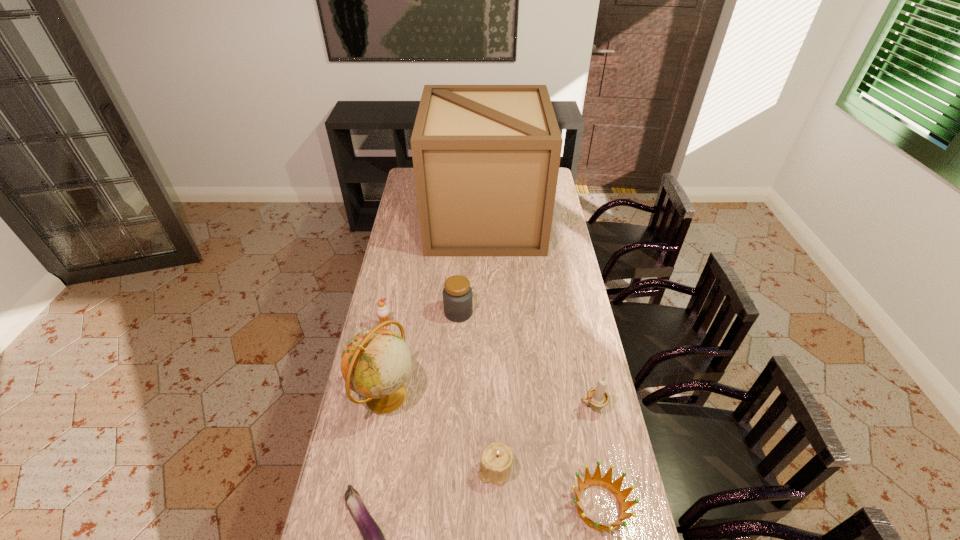
Find the location of a particular element. The height and width of the screenshot is (540, 960). vacant area between the icecream and the farther candle_holder is located at coordinates (489, 366).

The height and width of the screenshot is (540, 960). I want to click on object that ranks as the fourth closest to the jar, so click(x=598, y=398).

At what (x,y) coordinates should I click in order to perform the action: click on object identified as the third closest to the shortest object. Please return your answer as a coordinate pair (x, y). The height and width of the screenshot is (540, 960). Looking at the image, I should click on (606, 482).

This screenshot has width=960, height=540. I want to click on vacant space that satisfies the following two spatial constraints: 1. at the front with a straw on the icecream; 2. on the right side of the shorter candle_holder, so click(x=356, y=469).

What are the coordinates of `free space that satisfies the following two spatial constraints: 1. on the surface of the jar near the warning symbol; 2. at the front with a straw on the icecream` in the screenshot? It's located at (458, 325).

Locate an element on the screen. free space that satisfies the following two spatial constraints: 1. on the reinforced sides of the farthest object; 2. at the front with a straw on the icecream is located at coordinates (487, 325).